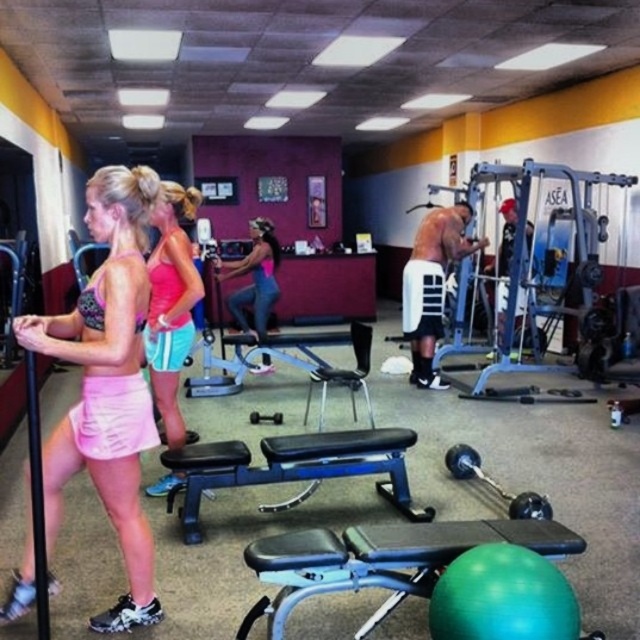
Can you confirm if black leather bench at center is positioned above black rubber dumbbell at center?

Yes, black leather bench at center is above black rubber dumbbell at center.

Who is shorter, black leather bench at center or black rubber dumbbell at center?

black rubber dumbbell at center is shorter.

Is point (296, 465) farther from camera compared to point (458, 472)?

No.

This screenshot has height=640, width=640. In order to click on black leather bench at center in this screenshot , I will do `click(292, 467)`.

Between pink fabric shorts at left and pink fabric shorts at center, which one is positioned higher?

pink fabric shorts at center

Does pink fabric shorts at left have a greater width compared to pink fabric shorts at center?

Yes, pink fabric shorts at left is wider than pink fabric shorts at center.

The width and height of the screenshot is (640, 640). What do you see at coordinates (106, 385) in the screenshot?
I see `pink fabric shorts at left` at bounding box center [106, 385].

Find the location of a particular element. pink fabric shorts at left is located at coordinates (106, 385).

Between green rubber exercise ball at center and shiny white padded arm guard at center, which one has more height?

shiny white padded arm guard at center is taller.

Looking at this image, between green rubber exercise ball at center and shiny white padded arm guard at center, which one appears on the right side from the viewer's perspective?

From the viewer's perspective, shiny white padded arm guard at center appears more on the right side.

Is point (408, 525) positioned after point (435, 298)?

No, (408, 525) is in front of (435, 298).

Find the location of a particular element. The height and width of the screenshot is (640, 640). green rubber exercise ball at center is located at coordinates (381, 561).